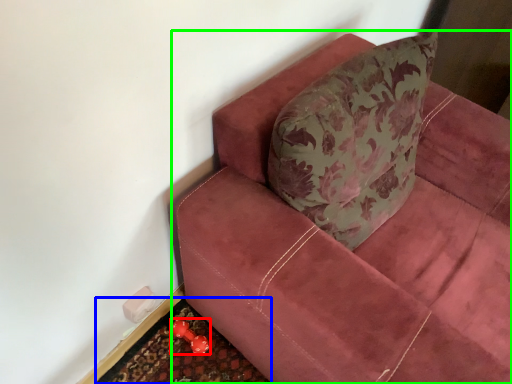
Question: Which object is positioned closest to toy (highlighted by a red box)? Select from doormat (highlighted by a blue box) and studio couch (highlighted by a green box).

Choices:
 (A) doormat
 (B) studio couch

Answer: (A)